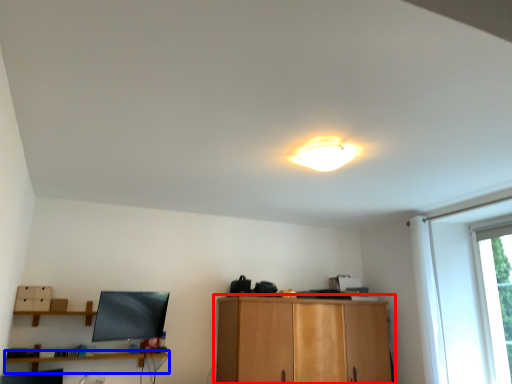
Question: Which point is further to the camera, cabinetry (highlighted by a red box) or shelf (highlighted by a blue box)?

Choices:
 (A) cabinetry
 (B) shelf

Answer: (A)